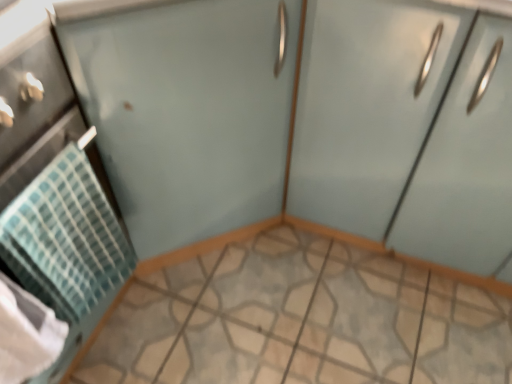
Question: From a real-world perspective, does matte light blue cabinet at right stand above matte teal towel at left?

Choices:
 (A) yes
 (B) no

Answer: (A)

Question: Considering the relative sizes of matte light blue cabinet at right and matte teal towel at left in the image provided, is matte light blue cabinet at right thinner than matte teal towel at left?

Choices:
 (A) no
 (B) yes

Answer: (B)

Question: Is matte light blue cabinet at right positioned with its back to matte teal towel at left?

Choices:
 (A) no
 (B) yes

Answer: (A)

Question: Is matte light blue cabinet at right further to camera compared to matte teal towel at left?

Choices:
 (A) no
 (B) yes

Answer: (B)

Question: Is matte light blue cabinet at right smaller than matte teal towel at left?

Choices:
 (A) yes
 (B) no

Answer: (B)

Question: From the image's perspective, is clear glass screen door at upper right positioned above or below matte light blue cabinet at right?

Choices:
 (A) above
 (B) below

Answer: (A)

Question: In terms of width, does clear glass screen door at upper right look wider or thinner when compared to matte light blue cabinet at right?

Choices:
 (A) wide
 (B) thin

Answer: (A)

Question: From a real-world perspective, is clear glass screen door at upper right above or below matte light blue cabinet at right?

Choices:
 (A) above
 (B) below

Answer: (A)

Question: From their relative heights in the image, would you say clear glass screen door at upper right is taller or shorter than matte light blue cabinet at right?

Choices:
 (A) short
 (B) tall

Answer: (B)

Question: Considering their positions, is matte teal towel at left located in front of or behind clear glass screen door at upper right?

Choices:
 (A) behind
 (B) front

Answer: (B)

Question: Is matte teal towel at left bigger or smaller than clear glass screen door at upper right?

Choices:
 (A) small
 (B) big

Answer: (A)

Question: Does point (19, 188) appear closer or farther from the camera than point (260, 72)?

Choices:
 (A) closer
 (B) farther

Answer: (A)

Question: From a real-world perspective, is matte teal towel at left above or below clear glass screen door at upper right?

Choices:
 (A) above
 (B) below

Answer: (B)

Question: Is point (68, 145) closer or farther from the camera than point (117, 264)?

Choices:
 (A) farther
 (B) closer

Answer: (B)

Question: Is teal woven towel at left to the left or to the right of matte teal towel at left in the image?

Choices:
 (A) left
 (B) right

Answer: (B)